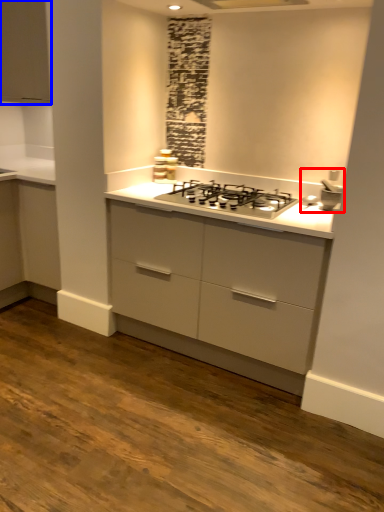
Question: Which object is further to the camera taking this photo, sink (highlighted by a red box) or cabinetry (highlighted by a blue box)?

Choices:
 (A) sink
 (B) cabinetry

Answer: (B)